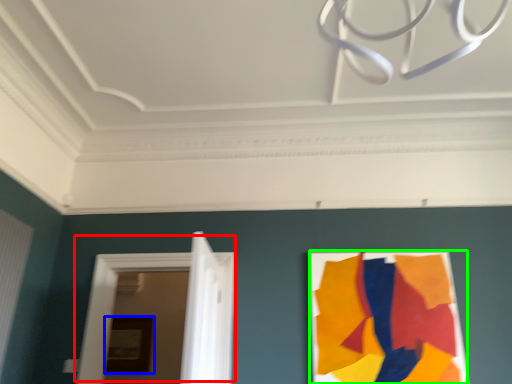
Question: Estimate the real-world distances between objects in this image. Which object is farther from door (highlighted by a red box), picture frame (highlighted by a blue box) or poster (highlighted by a green box)?

Choices:
 (A) picture frame
 (B) poster

Answer: (A)